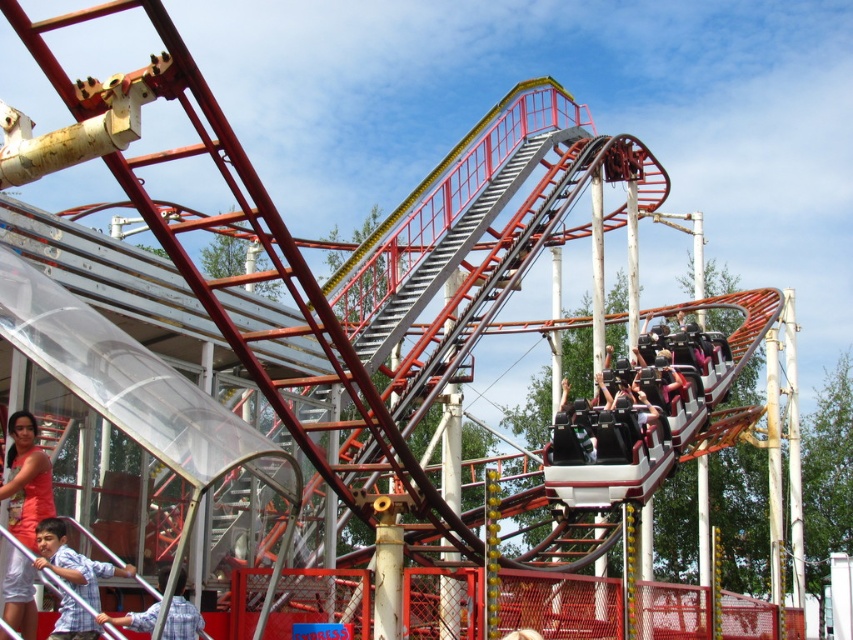
Question: Which of the following is the closest to the observer?

Choices:
 (A) blue plaid shirt at lower left
 (B) black matte seats at center
 (C) matte red dress at lower left
 (D) light blue shirt at lower left

Answer: (A)

Question: Among these objects, which one is farthest from the camera?

Choices:
 (A) black matte seats at center
 (B) matte red dress at lower left

Answer: (A)

Question: Among these objects, which one is farthest from the camera?

Choices:
 (A) blue plaid shirt at lower left
 (B) black matte seats at center

Answer: (B)

Question: Can you confirm if smooth brown roller coaster at center is positioned below matte red dress at lower left?

Choices:
 (A) yes
 (B) no

Answer: (B)

Question: In this image, where is smooth brown roller coaster at center located relative to matte red dress at lower left?

Choices:
 (A) below
 (B) above

Answer: (B)

Question: Does matte red dress at lower left have a larger size compared to blue plaid shirt at lower left?

Choices:
 (A) no
 (B) yes

Answer: (A)